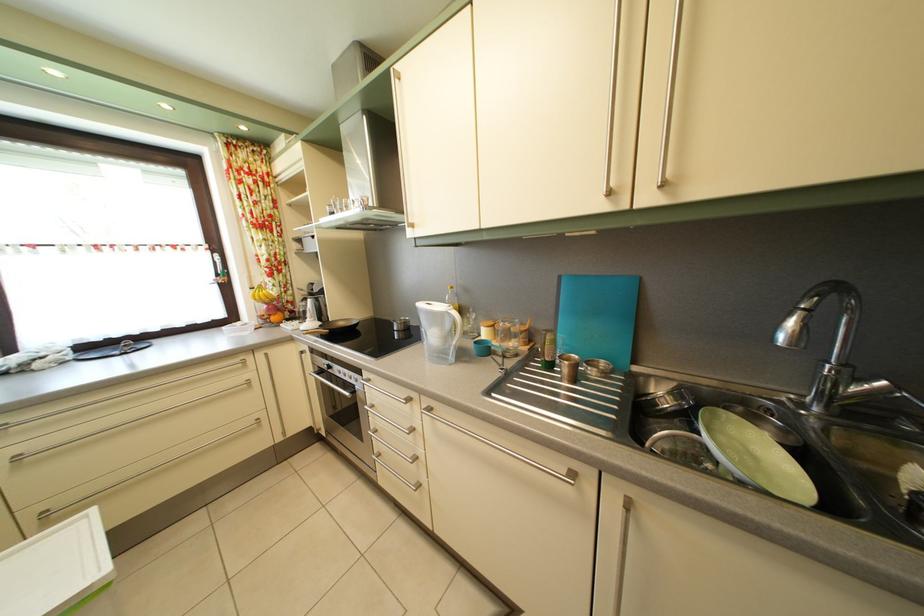
Find where to pull the faucet handle. Please return your answer as a coordinate pair (x, y).

(865, 390)